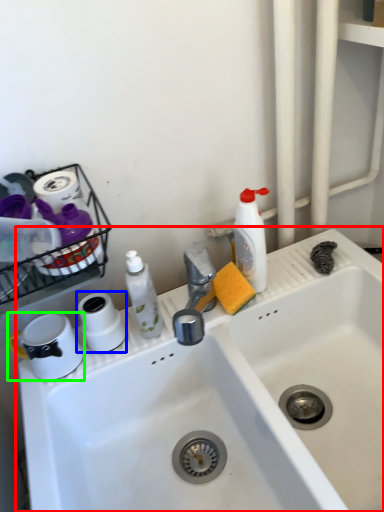
Question: Which object is the closest to the sink (highlighted by a red box)? Choose among these: toilet paper (highlighted by a blue box) or appliance (highlighted by a green box).

Choices:
 (A) toilet paper
 (B) appliance

Answer: (A)